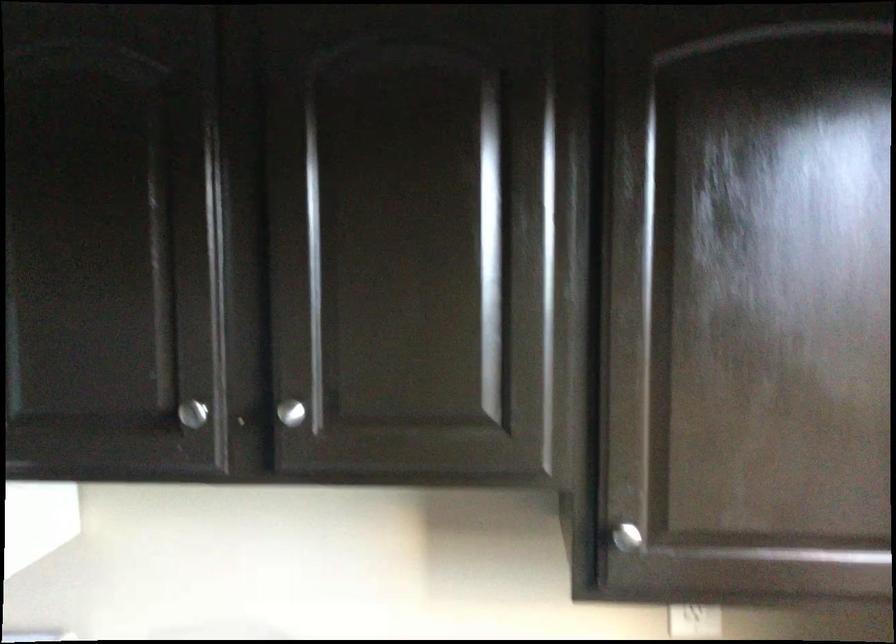
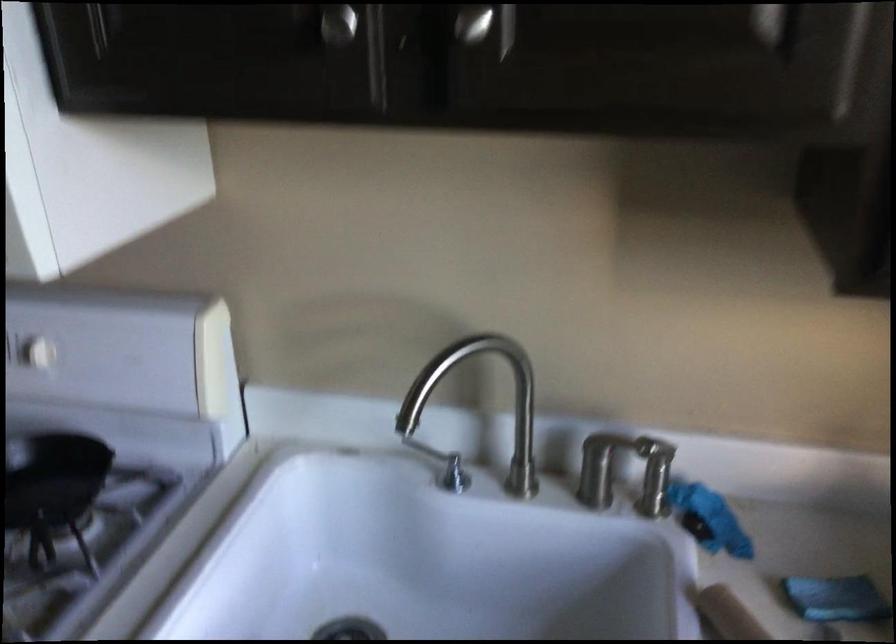
The point at (511,412) is marked in the first image. Where is the corresponding point in the second image?

(794, 24)